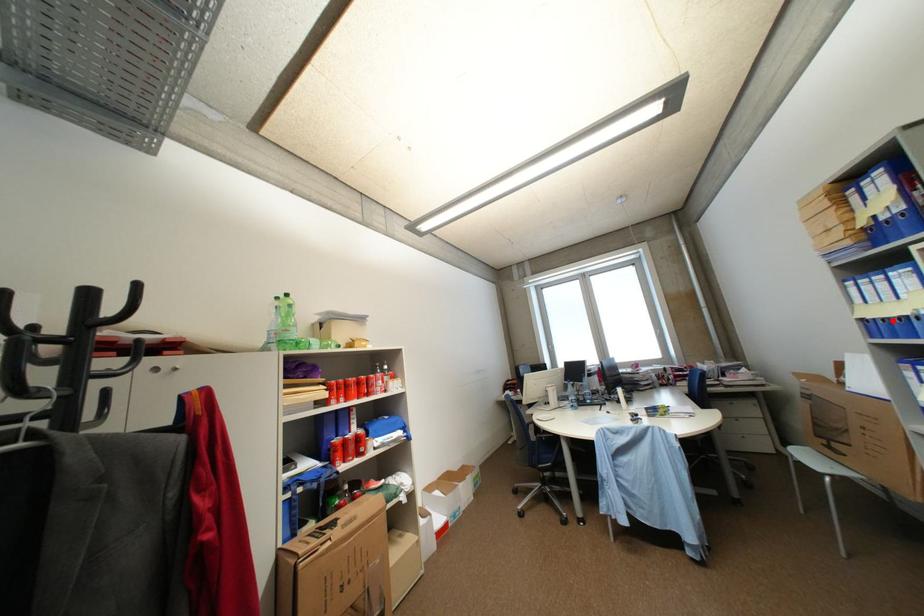
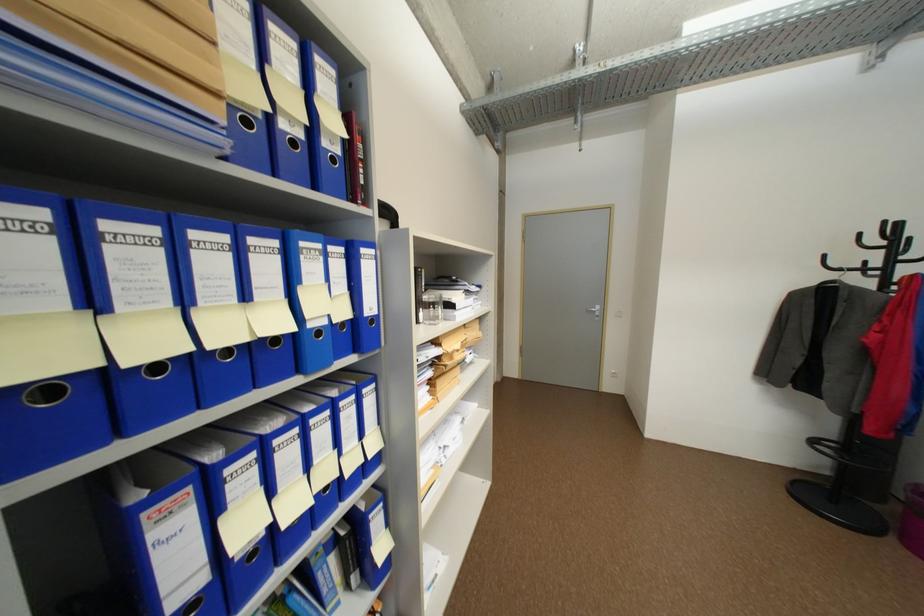
Where in the second image is the point corresponding to the highlighted location from the first image?

(164, 368)